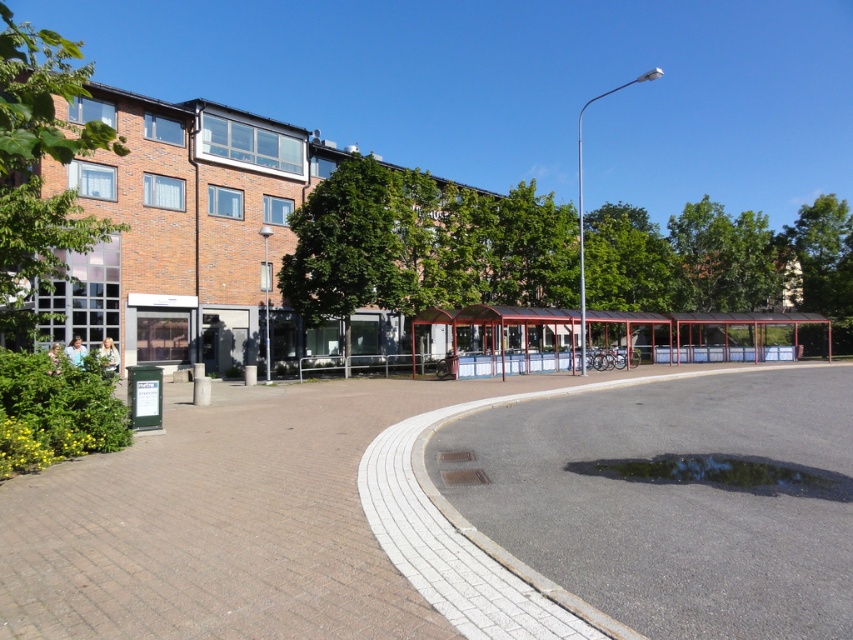
Question: Which point is closer to the camera taking this photo?

Choices:
 (A) (529, 324)
 (B) (804, 470)
 (C) (315, 513)

Answer: (C)

Question: Does brick pavement at lower left appear under metallic red bus stop at center?

Choices:
 (A) no
 (B) yes

Answer: (B)

Question: Can you confirm if metallic red bus stop at center is positioned to the left of transparent wet asphalt at lower center?

Choices:
 (A) yes
 (B) no

Answer: (B)

Question: Which of the following is the farthest from the observer?

Choices:
 (A) metallic red bus stop at center
 (B) transparent wet asphalt at lower center
 (C) brick pavement at lower left

Answer: (A)

Question: Does brick pavement at lower left have a larger size compared to metallic red bus stop at center?

Choices:
 (A) no
 (B) yes

Answer: (A)

Question: Which point is farther to the camera?

Choices:
 (A) brick pavement at lower left
 (B) transparent wet asphalt at lower center

Answer: (B)